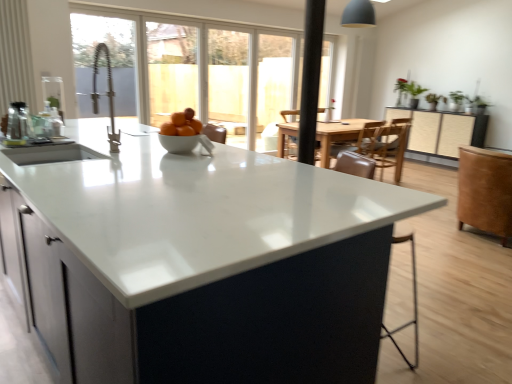
Identify the location of white glass screen door at center, the first screen door from the left. The height and width of the screenshot is (384, 512). click(x=229, y=82).

What is the approximate height of white glass screen door at center, the first screen door from the left?

The height of white glass screen door at center, the first screen door from the left, is 1.80 meters.

What do you see at coordinates (310, 79) in the screenshot? I see `black matte pole at center` at bounding box center [310, 79].

What do you see at coordinates (485, 191) in the screenshot? The height and width of the screenshot is (384, 512). I see `brown leather swivel chair at right` at bounding box center [485, 191].

Where is `matte white bowl at center`? The image size is (512, 384). matte white bowl at center is located at coordinates (182, 124).

What do you see at coordinates (182, 124) in the screenshot? I see `matte white bowl at center` at bounding box center [182, 124].

Measure the distance between point [275,55] and camera.

7.63 meters.

Where is `white glass screen door at center, the first screen door from the left`? This screenshot has width=512, height=384. white glass screen door at center, the first screen door from the left is located at coordinates (229, 82).

Between wooden screen at center, acting as the second window screen starting from the front, and brown leather armchair at center, which one is positioned behind?

wooden screen at center, acting as the second window screen starting from the front, is further from the camera.

Can you confirm if wooden screen at center, acting as the second window screen starting from the front, is thinner than brown leather armchair at center?

Correct, the width of wooden screen at center, acting as the second window screen starting from the front, is less than that of brown leather armchair at center.

Can you confirm if wooden screen at center, acting as the second window screen starting from the front, is bigger than brown leather armchair at center?

Incorrect, wooden screen at center, acting as the second window screen starting from the front, is not larger than brown leather armchair at center.

From a real-world perspective, who is located lower, wooden screen at center, acting as the second window screen starting from the front, or brown leather armchair at center?

From a 3D spatial view, brown leather armchair at center is below.

Is white glass screen door at center, the first screen door from the left, spatially inside brown leather armchair at center, or outside of it?

white glass screen door at center, the first screen door from the left, is not enclosed by brown leather armchair at center.

From the image's perspective, relative to brown leather armchair at center, is white glass screen door at center, marked as the second screen door in a right-to-left arrangement, above or below?

→ white glass screen door at center, marked as the second screen door in a right-to-left arrangement, is situated higher than brown leather armchair at center in the image.

From their relative heights in the image, would you say white glass screen door at center, the first screen door from the left, is taller or shorter than brown leather armchair at center?

white glass screen door at center, the first screen door from the left, is taller than brown leather armchair at center.

From a real-world perspective, is white glossy bowl at center physically located above or below brown leather swivel chair at right?

white glossy bowl at center is above brown leather swivel chair at right.

Is white glossy bowl at center next to brown leather swivel chair at right and touching it?

No.

Considering the sizes of white glossy bowl at center and brown leather swivel chair at right in the image, is white glossy bowl at center taller or shorter than brown leather swivel chair at right?

Clearly, white glossy bowl at center is shorter compared to brown leather swivel chair at right.

From the image's perspective, which is below, white glossy bowl at center or brown leather swivel chair at right?

brown leather swivel chair at right.

Is transparent glass screen door at center, the 1th screen door from the right, located outside white glossy bowl at center?

transparent glass screen door at center, the 1th screen door from the right, is positioned outside white glossy bowl at center.

How distant is transparent glass screen door at center, the 2th screen door in the left-to-right sequence, from white glossy bowl at center?

The distance of transparent glass screen door at center, the 2th screen door in the left-to-right sequence, from white glossy bowl at center is 5.29 meters.

Is transparent glass screen door at center, the 1th screen door from the right, wider or thinner than white glossy bowl at center?

In the image, transparent glass screen door at center, the 1th screen door from the right, appears to be more narrow than white glossy bowl at center.

Which is more to the right, transparent glass screen door at center, the 2th screen door in the left-to-right sequence, or white glossy bowl at center?

transparent glass screen door at center, the 2th screen door in the left-to-right sequence, is more to the right.

Considering the sizes of objects brown leather swivel chair at right and brown leather armchair at center in the image provided, who is thinner, brown leather swivel chair at right or brown leather armchair at center?

brown leather armchair at center.

Is brown leather swivel chair at right smaller than brown leather armchair at center?

Incorrect, brown leather swivel chair at right is not smaller in size than brown leather armchair at center.

Is brown leather swivel chair at right positioned beyond the bounds of brown leather armchair at center?

brown leather swivel chair at right is positioned outside brown leather armchair at center.

Is brown leather swivel chair at right beside brown leather armchair at center?

No, brown leather swivel chair at right is not beside brown leather armchair at center.

Is wooden screen at center, arranged as the first window screen when viewed from the back, further to camera compared to white glass screen door at center, the first screen door from the left?

No, the depth of wooden screen at center, arranged as the first window screen when viewed from the back, is less than that of white glass screen door at center, the first screen door from the left.

From a real-world perspective, who is located lower, wooden screen at center, the 2th window screen ordered from the bottom, or white glass screen door at center, the first screen door from the left?

white glass screen door at center, the first screen door from the left.

Measure the distance from wooden screen at center, arranged as the first window screen when viewed from the back, to white glass screen door at center, the first screen door from the left.

26.79 inches.

Which window screen is the 2nd one when counting from the left side of the white glass screen door at center, marked as the second screen door in a right-to-left arrangement? Please provide its 2D coordinates.

[(170, 69)]

Considering the relative positions of brown leather armchair at center and white glass screen door at center, marked as the second screen door in a right-to-left arrangement, in the image provided, is brown leather armchair at center behind white glass screen door at center, marked as the second screen door in a right-to-left arrangement,?

No, it is not.

Looking at this image, from a real-world perspective, who is located higher, brown leather armchair at center or white glass screen door at center, marked as the second screen door in a right-to-left arrangement?

white glass screen door at center, marked as the second screen door in a right-to-left arrangement, is physically above.

Consider the image. Considering the relative sizes of brown leather armchair at center and white glass screen door at center, marked as the second screen door in a right-to-left arrangement, in the image provided, is brown leather armchair at center wider than white glass screen door at center, marked as the second screen door in a right-to-left arrangement,?

Indeed, brown leather armchair at center has a greater width compared to white glass screen door at center, marked as the second screen door in a right-to-left arrangement.

Considering the relative sizes of brown leather armchair at center and white glass screen door at center, the first screen door from the left, in the image provided, is brown leather armchair at center smaller than white glass screen door at center, the first screen door from the left,?

Incorrect, brown leather armchair at center is not smaller in size than white glass screen door at center, the first screen door from the left.

The height and width of the screenshot is (384, 512). I want to click on armchair below the wooden screen at center, the 2th window screen ordered from the bottom (from the image's perspective), so click(386, 145).

Identify the location of armchair in front of the white glass screen door at center, the first screen door from the left. The height and width of the screenshot is (384, 512). (386, 145).

Considering their positions, is transparent glass screen door at center, the 2th screen door in the left-to-right sequence, positioned further to white glossy bowl at center than wooden screen at center, arranged as the first window screen when viewed from the back?

wooden screen at center, arranged as the first window screen when viewed from the back, is positioned further to the anchor white glossy bowl at center.

When comparing their distances from matte black cabinet at center, does black matte faucet at upper left, the 1th window screen viewed from the front, or matte white bowl at center seem closer?

Based on the image, black matte faucet at upper left, the 1th window screen viewed from the front, appears to be nearer to matte black cabinet at center.

From the image, which object appears to be farther from transparent glass screen door at center, the 2th screen door in the left-to-right sequence, black matte faucet at upper left, which is counted as the first window screen, starting from the bottom, or wooden screen at center, the 2th window screen ordered from the bottom?

The object further to transparent glass screen door at center, the 2th screen door in the left-to-right sequence, is black matte faucet at upper left, which is counted as the first window screen, starting from the bottom.

From the image, which object appears to be farther from transparent glass screen door at center, the 1th screen door from the right, black matte pole at center or matte black cabinet at center?

Among the two, black matte pole at center is located further to transparent glass screen door at center, the 1th screen door from the right.

From the image, which object appears to be farther from white glass screen door at center, the first screen door from the left, transparent glass screen door at center, the 1th screen door from the right, or black matte pole at center?

black matte pole at center lies further to white glass screen door at center, the first screen door from the left, than the other object.

Based on their spatial positions, is matte black cabinet at center or brown leather armchair at center closer to matte white bowl at center?

Based on the image, brown leather armchair at center appears to be nearer to matte white bowl at center.

Looking at the image, which one is located closer to matte black cabinet at center, black matte pole at center or black matte faucet at upper left, arranged as the second window screen when viewed from the top?

black matte pole at center is positioned closer to the anchor matte black cabinet at center.

Looking at the image, which one is located closer to brown leather swivel chair at right, white glossy bowl at center or white glossy countertop at center?

Based on the image, white glossy bowl at center appears to be nearer to brown leather swivel chair at right.

The image size is (512, 384). What are the coordinates of `window screen between white glossy bowl at center and white glass screen door at center, the first screen door from the left, in the front-back direction` in the screenshot? It's located at (170, 69).

You are a GUI agent. You are given a task and a screenshot of the screen. Output one action in this format:
    pyautogui.click(x=<x>, y=<y>)
    Task: Click on the pole between wooden screen at center, the first window screen from the top, and matte black cabinet at center, in the horizontal direction
    The height and width of the screenshot is (384, 512).
    Given the screenshot: What is the action you would take?
    pyautogui.click(x=310, y=79)

The height and width of the screenshot is (384, 512). I want to click on orange located between black matte faucet at upper left, arranged as the second window screen when viewed from the top, and wooden screen at center, the first window screen from the top, in the depth direction, so coord(182,124).

Where is `armchair between black matte faucet at upper left, arranged as the second window screen when viewed from the top, and matte black cabinet at center in the front-back direction`? armchair between black matte faucet at upper left, arranged as the second window screen when viewed from the top, and matte black cabinet at center in the front-back direction is located at coordinates (386, 145).